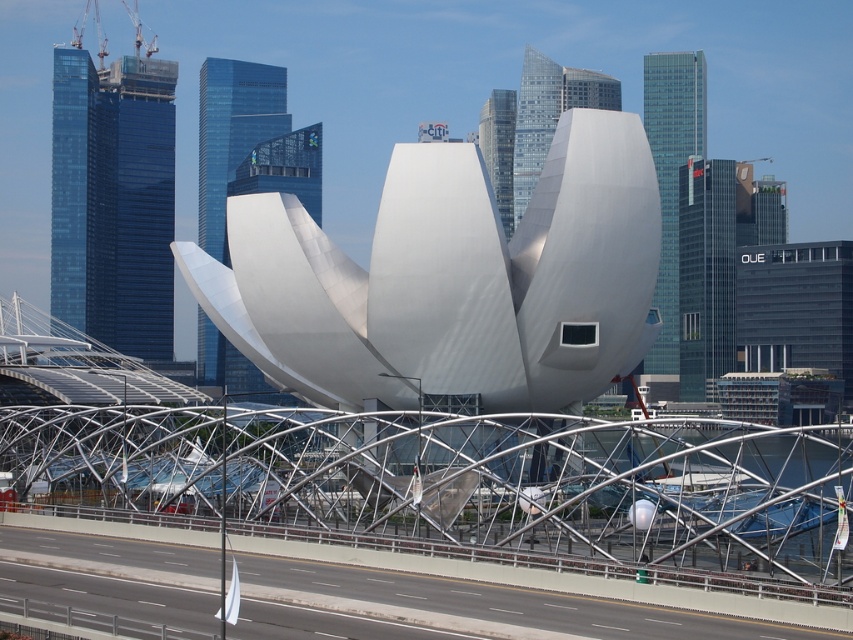
Based on the photo, you are standing at the point marked at coordinates [543,188]. You want to walk directly towards the nearest skyscraper in the city skyline. How far will you have to walk?

The distance between the point marked at coordinates [543,188] and the nearest skyscraper in the city skyline is 110.21 meters, so you will have to walk 110.21 meters.